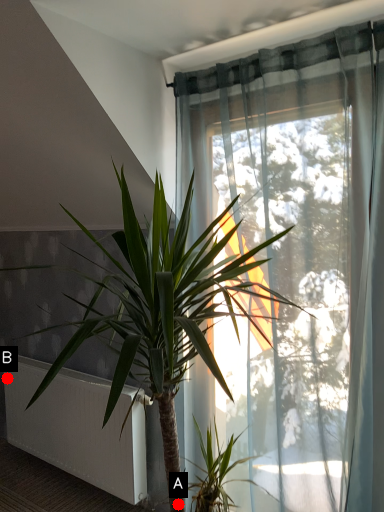
Question: Two points are circled on the image, labeled by A and B beside each circle. Which point is further to the camera?

Choices:
 (A) A is further
 (B) B is further

Answer: (B)